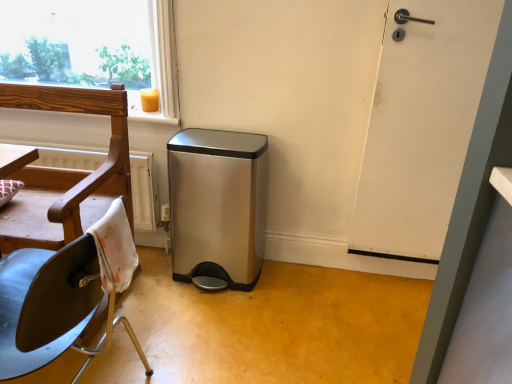
Find the location of a particular element. Image resolution: width=512 pixels, height=384 pixels. vacant region below white matte door at right (from a real-world perspective) is located at coordinates (390, 272).